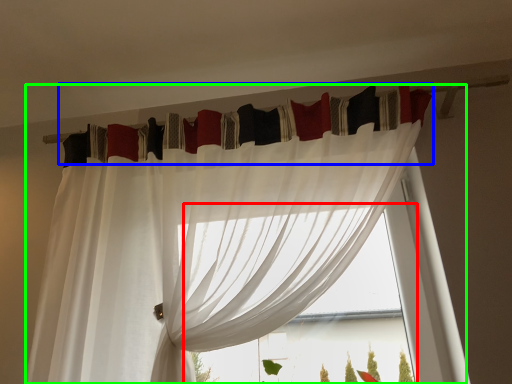
Question: Considering the real-world distances, which object is farthest from bay window (highlighted by a red box)? curtain (highlighted by a blue box) or curtain (highlighted by a green box)?

Choices:
 (A) curtain
 (B) curtain

Answer: (A)